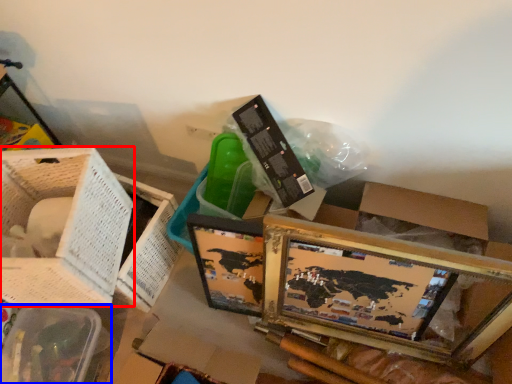
Question: Which object appears farthest to the camera in this image, basket (highlighted by a red box) or basket (highlighted by a blue box)?

Choices:
 (A) basket
 (B) basket

Answer: (B)